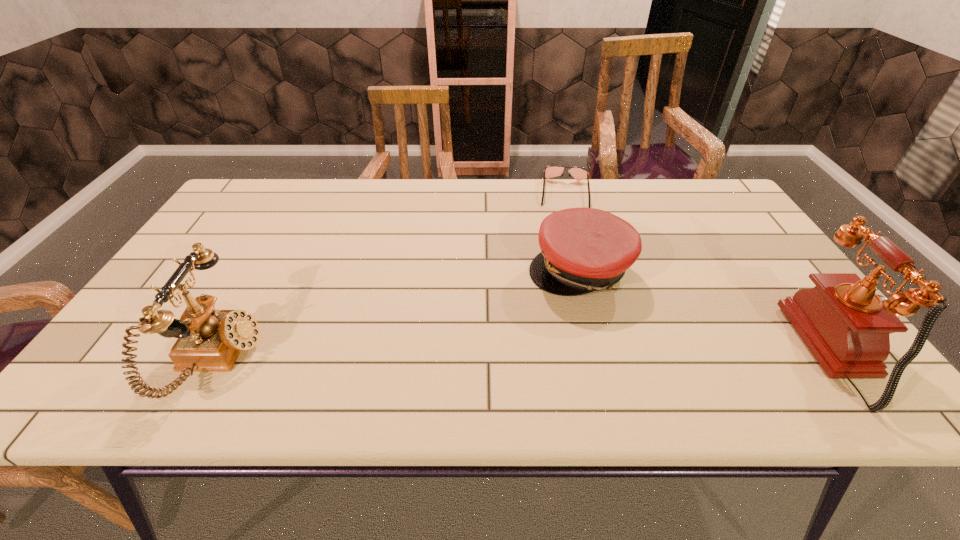
Locate an element on the screen. the second tallest object is located at coordinates (209, 340).

Locate an element on the screen. the leftmost object is located at coordinates (209, 340).

Find the location of a particular element. The image size is (960, 540). the tallest object is located at coordinates (846, 326).

Where is `the right telephone`? This screenshot has height=540, width=960. the right telephone is located at coordinates (846, 326).

Find the location of `the third tallest object`. the third tallest object is located at coordinates (583, 250).

You are a GUI agent. You are given a task and a screenshot of the screen. Output one action in this format:
    pyautogui.click(x=<x>, y=<y>)
    Task: Click on the farthest object
    
    Given the screenshot: What is the action you would take?
    pyautogui.click(x=550, y=171)

The image size is (960, 540). In order to click on the shortest object in this screenshot , I will do 550,171.

This screenshot has width=960, height=540. Identify the location of vacant space located 0.140m on the dial number of the third shortest object. [x=321, y=360].

You are a GUI agent. You are given a task and a screenshot of the screen. Output one action in this format:
    pyautogui.click(x=<x>, y=<y>)
    Task: Click on the vacant position located 0.180m on the front-facing side of the third tallest object
    
    Given the screenshot: What is the action you would take?
    pyautogui.click(x=542, y=355)

The width and height of the screenshot is (960, 540). I want to click on free space located on the front-facing side of the third tallest object, so click(543, 352).